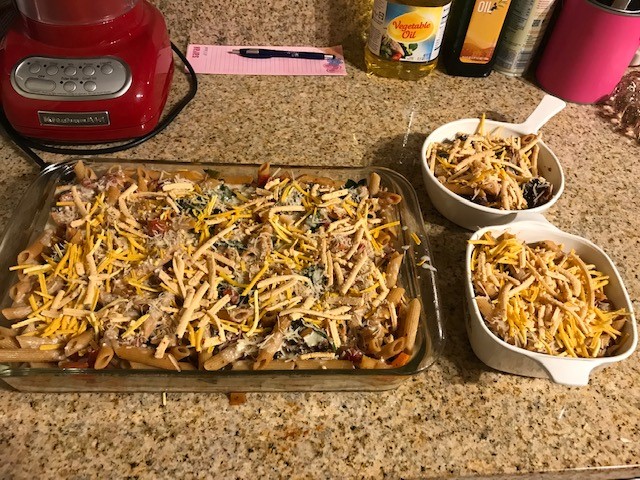
Where is `pyrex dish`? pyrex dish is located at coordinates (246, 382).